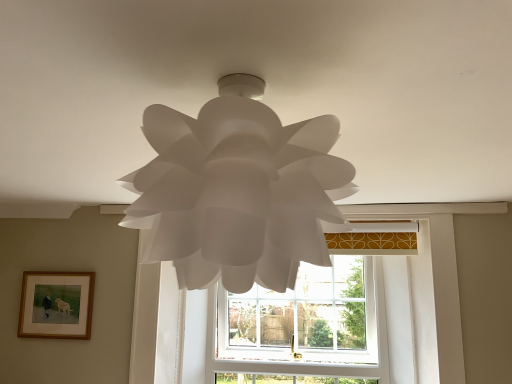
Question: Is wooden framed picture at lower left in front of or behind white plastic window at center in the image?

Choices:
 (A) behind
 (B) front

Answer: (B)

Question: Which is correct: wooden framed picture at lower left is inside white plastic window at center, or outside of it?

Choices:
 (A) inside
 (B) outside

Answer: (B)

Question: Which object is the farthest from the white paper lamp at center?

Choices:
 (A) white plastic window at center
 (B) wooden framed picture at lower left

Answer: (A)

Question: Estimate the real-world distances between objects in this image. Which object is closer to the white plastic window at center?

Choices:
 (A) wooden framed picture at lower left
 (B) white paper lamp at center

Answer: (A)